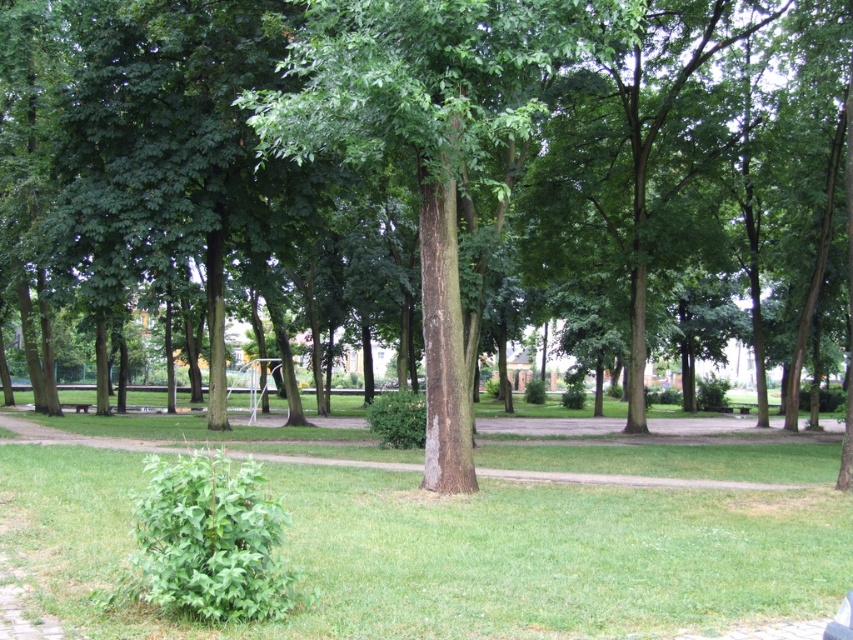
Is green grass at center below wooden park bench at lower left?

Actually, green grass at center is above wooden park bench at lower left.

Who is lower down, green grass at center or wooden park bench at lower left?

wooden park bench at lower left

Between point (323, 488) and point (74, 406), which one is positioned in front?

Point (323, 488)

What are the coordinates of `green grass at center` in the screenshot? It's located at (450, 552).

How much distance is there between green grass at center and green rough bark tree at center?

A distance of 4.08 meters exists between green grass at center and green rough bark tree at center.

Which of these two, green grass at center or green rough bark tree at center, stands shorter?

Standing shorter between the two is green grass at center.

Who is more forward, (386,612) or (453,400)?

Point (386,612) is in front.

Where is `green grass at center`? green grass at center is located at coordinates (450, 552).

Is green rough bark tree at center positioned before wooden park bench at lower left?

Yes, green rough bark tree at center is closer to the viewer.

Between green rough bark tree at center and wooden park bench at lower left, which one appears on the right side from the viewer's perspective?

green rough bark tree at center

Between point (451, 444) and point (84, 408), which one is positioned behind?

Positioned behind is point (84, 408).

The width and height of the screenshot is (853, 640). Find the location of `green rough bark tree at center`. green rough bark tree at center is located at coordinates (424, 145).